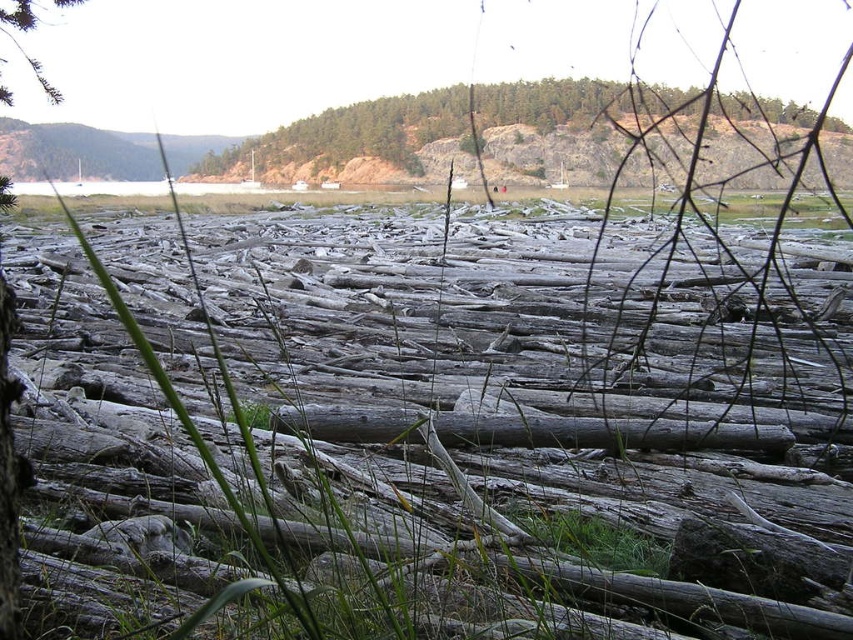
Question: Observing the image, what is the correct spatial positioning of green matte grass at center in reference to green matte tree at upper left?

Choices:
 (A) above
 (B) below

Answer: (B)

Question: Which point is farther to the camera?

Choices:
 (A) green textured hillside at upper center
 (B) green matte tree at upper left

Answer: (A)

Question: Estimate the real-world distances between objects in this image. Which object is closer to the green matte tree at upper left?

Choices:
 (A) green matte grass at center
 (B) green textured hillside at upper center

Answer: (A)

Question: Is green matte grass at center closer to the viewer compared to green textured hillside at upper center?

Choices:
 (A) yes
 (B) no

Answer: (A)

Question: Which point is closer to the camera?

Choices:
 (A) (520, 292)
 (B) (570, 128)
 (C) (16, 42)

Answer: (A)

Question: Does green textured hillside at upper center appear on the right side of green matte tree at upper left?

Choices:
 (A) yes
 (B) no

Answer: (A)